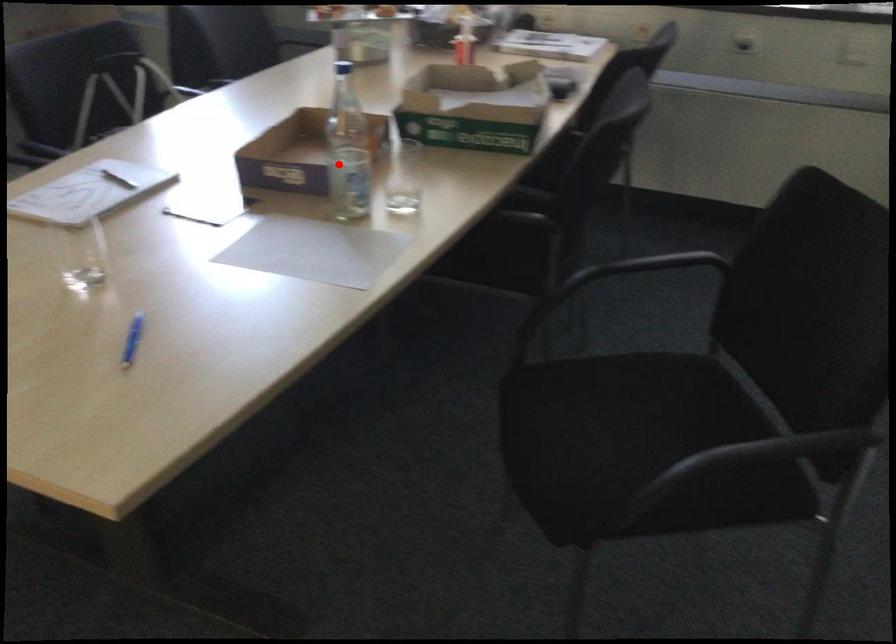
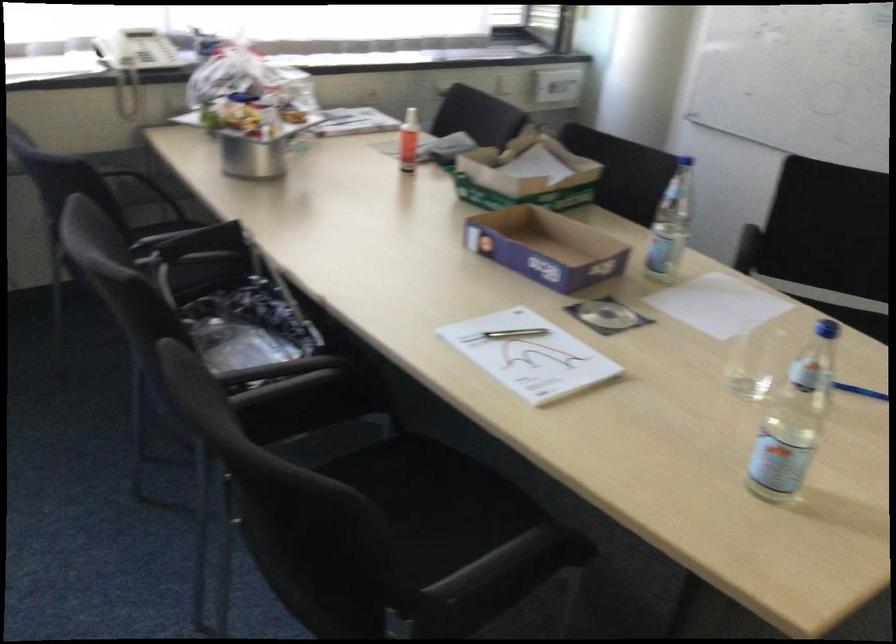
In the second image, find the point that corresponds to the highlighted location in the first image.

(546, 247)